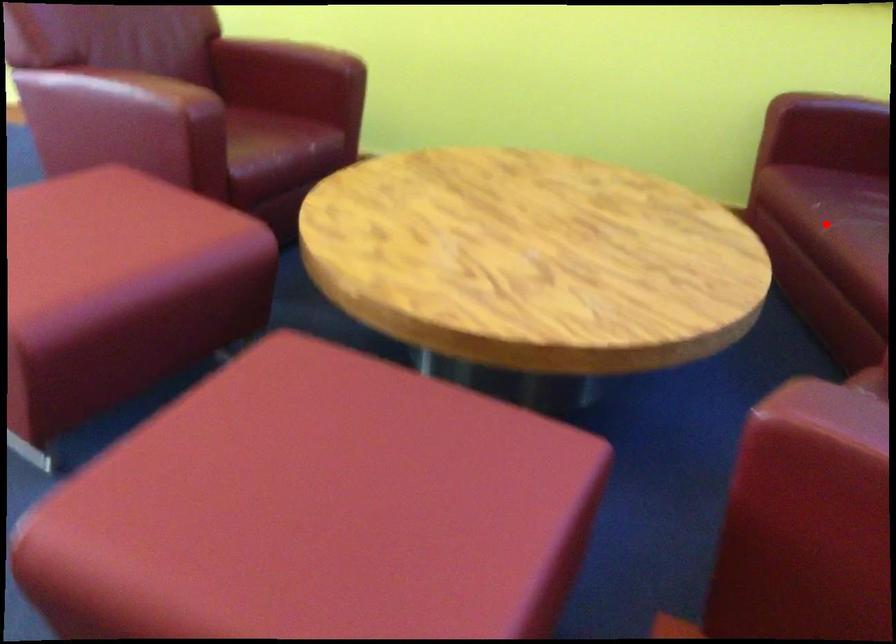
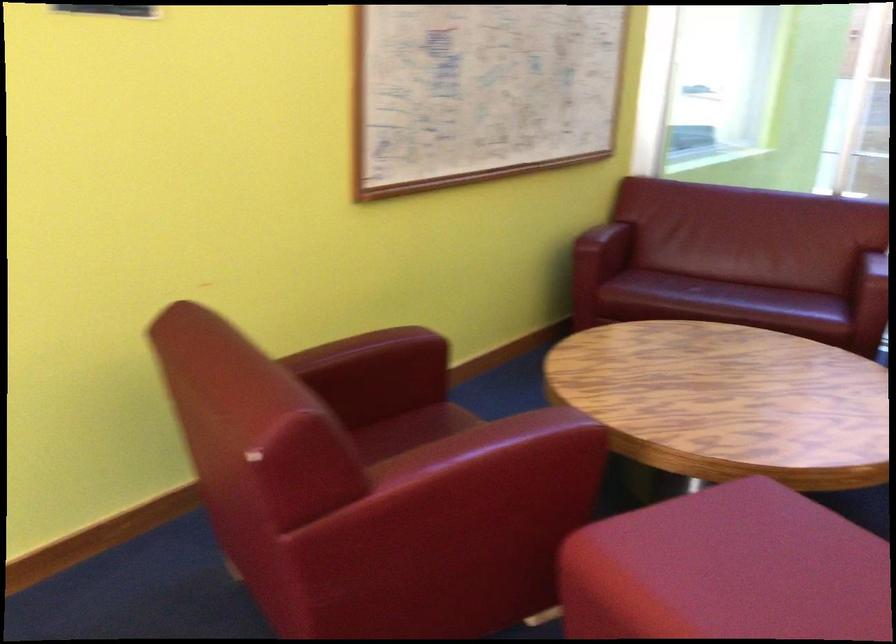
Find the pixel in the second image that matches the highlighted location in the first image.

(719, 297)